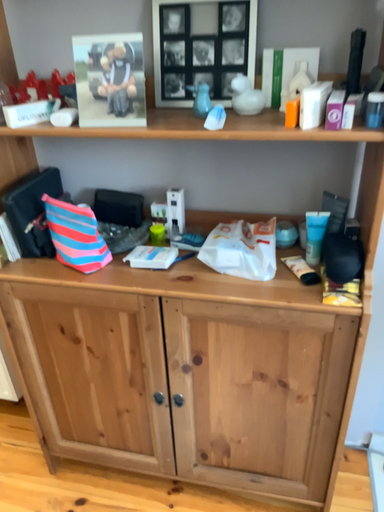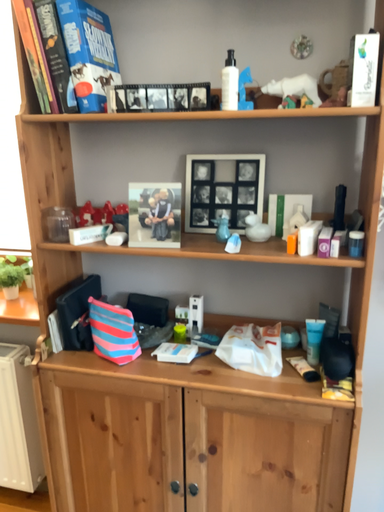
Question: Which way did the camera rotate in the video?

Choices:
 (A) rotated upward
 (B) rotated downward

Answer: (A)